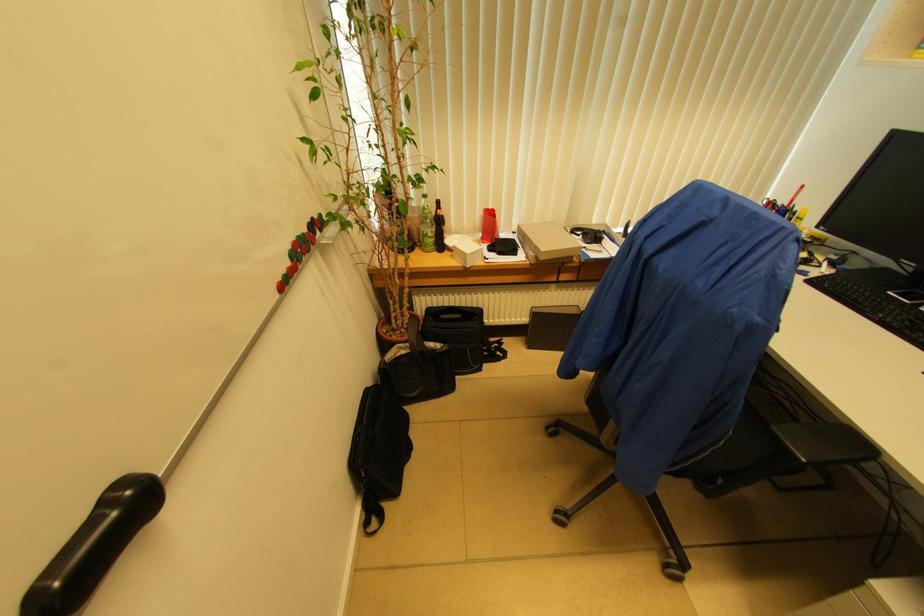
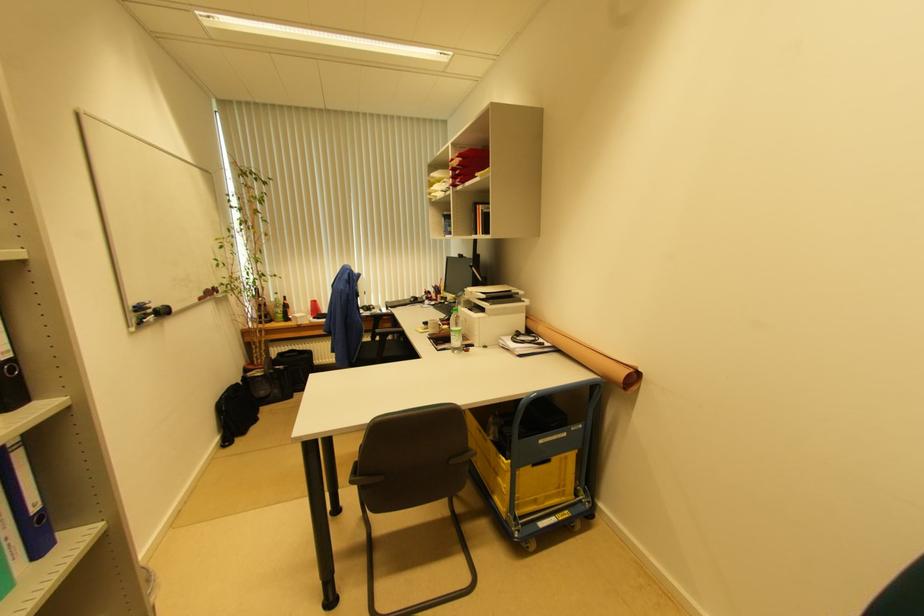
Find the pixel in the second image that matches the highlighted location in the first image.

(315, 302)